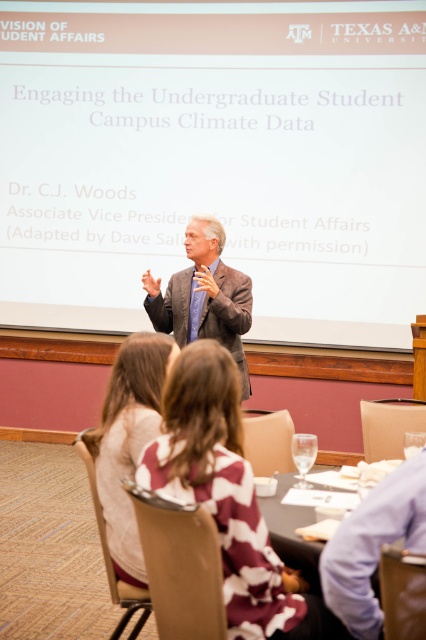
You are a guest speaker at Texas A M University, standing at the front of the room facing the audience. You notice two items on the table in front of you. Which object is closer to your left side, the camouflage fabric jacket at lower center or the translucent glass table at center?

The camouflage fabric jacket at lower center is to the left of the translucent glass table at center, so it is closer to your left side.

You are attending a presentation at Texas A M University and notice two items on the table. One is a camouflage fabric jacket at lower center and the other is a translucent glass table at center. Which item is taller?

The camouflage fabric jacket at lower center is taller than the translucent glass table at center.

You are attending a presentation at Texas A and M University and notice two items on the table in front of you. The camouflage fabric jacket at lower center and the light brown suit at center. Which item is positioned lower on the table?

The camouflage fabric jacket at lower center is located below the light brown suit at center, so it is positioned lower on the table.